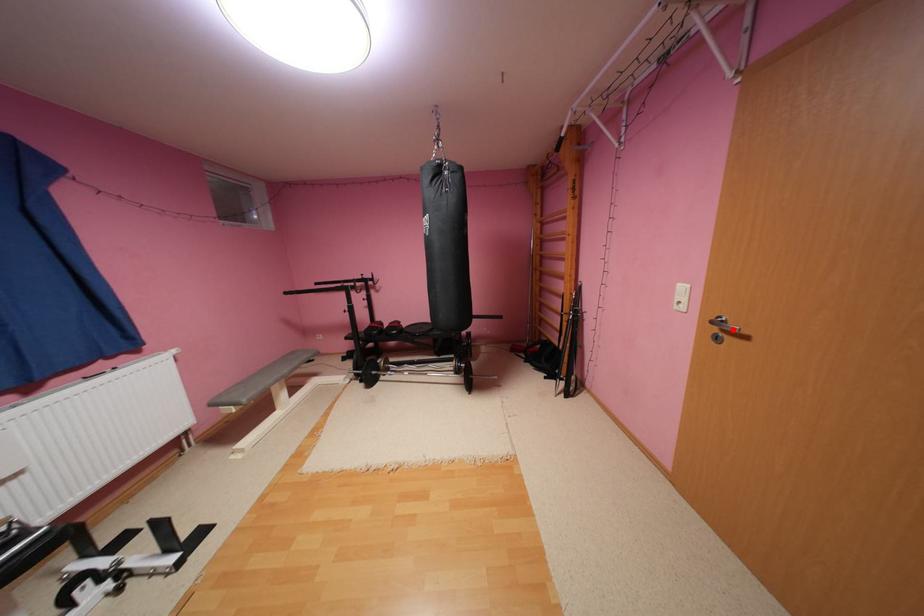
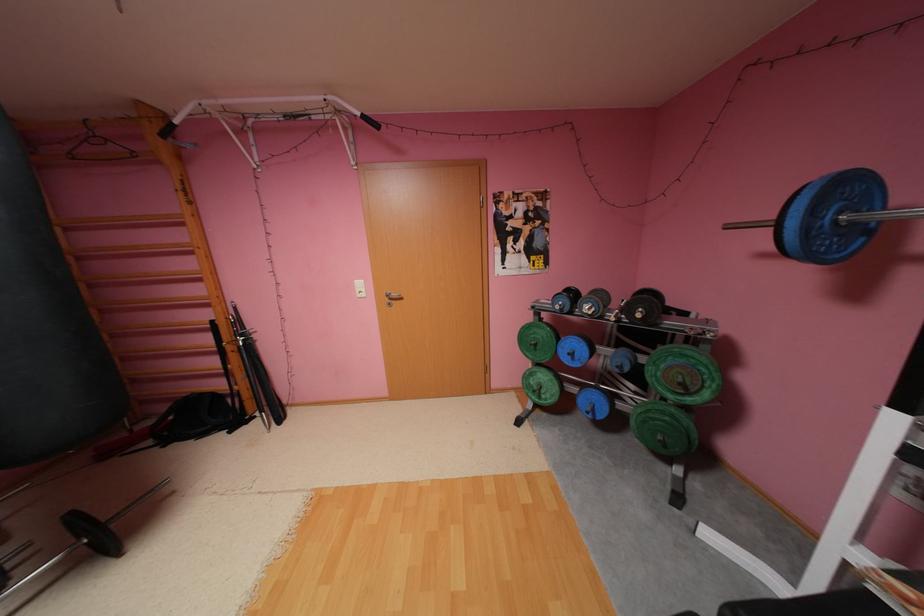
Locate, in the second image, the point that corresponds to the highlighted location in the first image.

(399, 299)